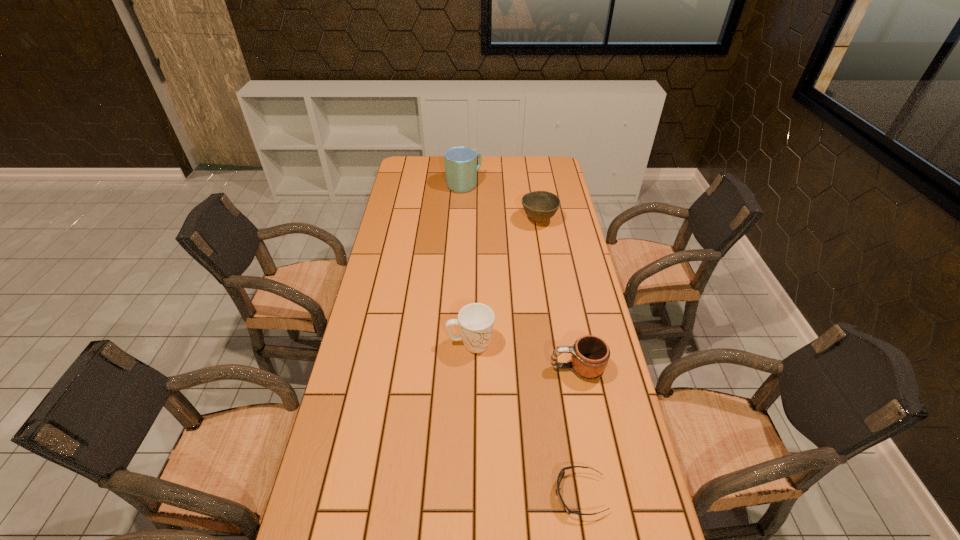
You are a GUI agent. You are given a task and a screenshot of the screen. Output one action in this format:
    pyautogui.click(x=<x>, y=<y>)
    Task: Click on the tallest object
    
    Given the screenshot: What is the action you would take?
    pyautogui.click(x=461, y=167)

You are a GUI agent. You are given a task and a screenshot of the screen. Output one action in this format:
    pyautogui.click(x=<x>, y=<y>)
    Task: Click on the farthest mug
    This screenshot has width=960, height=540.
    Given the screenshot: What is the action you would take?
    pyautogui.click(x=461, y=167)

Locate an element on the screen. the fourth shortest object is located at coordinates (475, 321).

Where is `the second farthest object`? This screenshot has height=540, width=960. the second farthest object is located at coordinates (540, 206).

This screenshot has height=540, width=960. What are the coordinates of `the shortest mug` in the screenshot? It's located at (590, 354).

Locate an element on the screen. The width and height of the screenshot is (960, 540). goggles is located at coordinates (562, 472).

You are a GUI agent. You are given a task and a screenshot of the screen. Output one action in this format:
    pyautogui.click(x=<x>, y=<y>)
    Task: Click on the shortest object
    Image resolution: width=960 pixels, height=540 pixels.
    Given the screenshot: What is the action you would take?
    pyautogui.click(x=562, y=472)

The width and height of the screenshot is (960, 540). In order to click on vacant position located 0.090m on the front of the farthest object in this screenshot , I will do `click(463, 205)`.

Locate an element on the screen. The image size is (960, 540). vacant position located 0.080m on the side of the second tallest object with the handle is located at coordinates (519, 343).

Identify the location of vacant region located 0.260m on the left of the fourth nearest object. (458, 220).